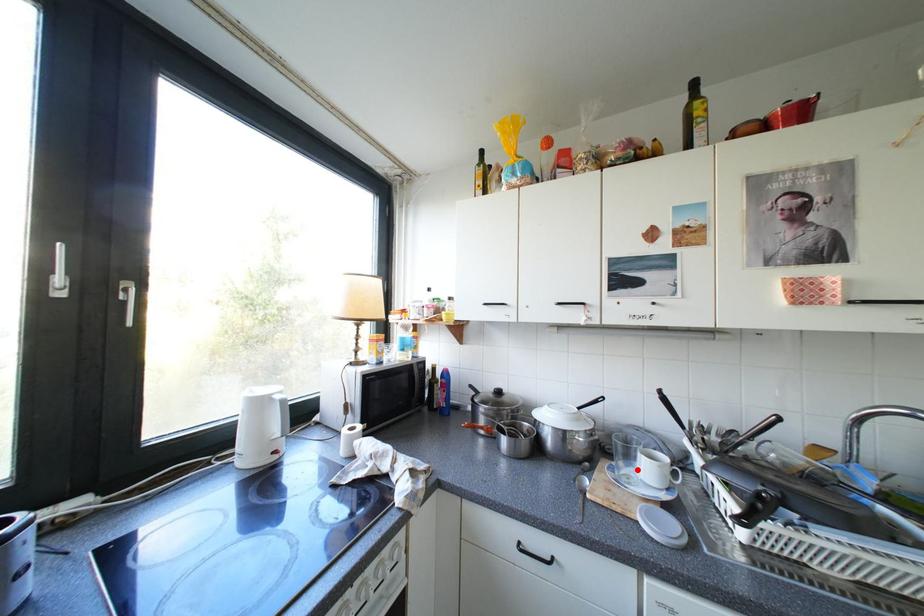
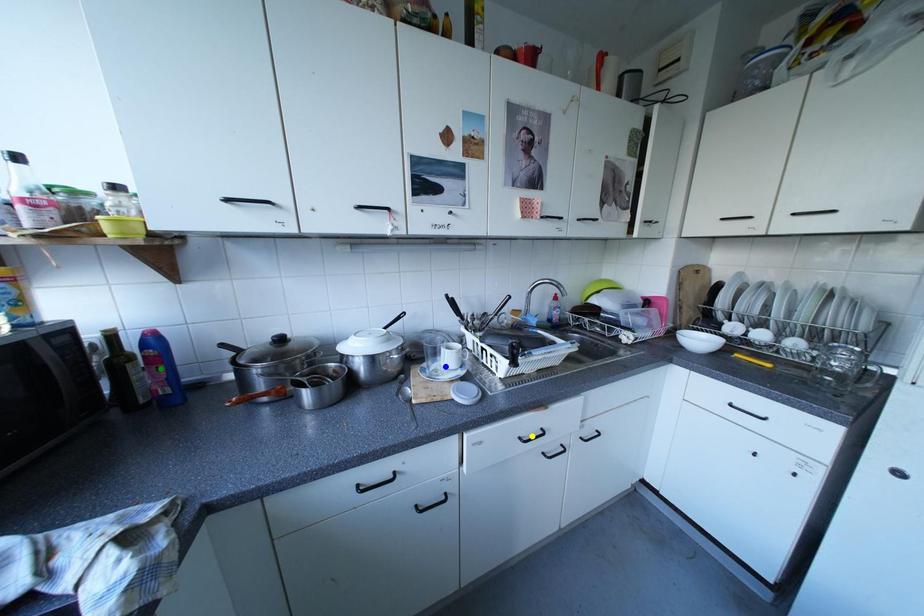
Question: I am providing you with two images of the same scene from different viewpoints. A red point is marked on the first image. You are given multiple points on the second image. Which spot in image 2 lines up with the point in image 1?

Choices:
 (A) yellow point
 (B) blue point
 (C) green point

Answer: (B)